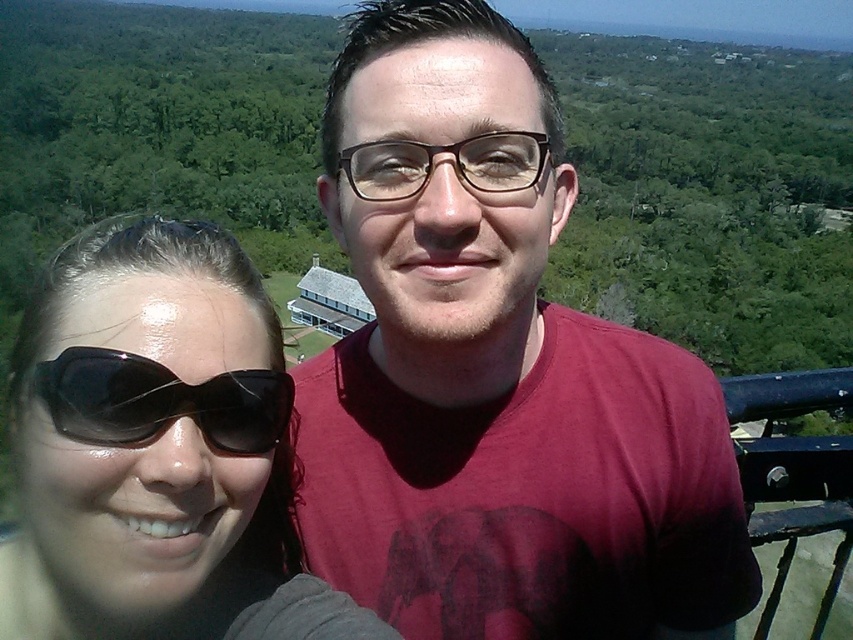
Question: Which point is farther to the camera?

Choices:
 (A) (235, 440)
 (B) (453, 560)
 (C) (138, 387)

Answer: (B)

Question: Among these objects, which one is farthest from the camera?

Choices:
 (A) sunglasses at left
 (B) matte red t-shirt at center

Answer: (B)

Question: Is the position of sunglasses at left more distant than that of black matte sunglasses at left?

Choices:
 (A) yes
 (B) no

Answer: (A)

Question: Is sunglasses at left to the right of black matte sunglasses at left from the viewer's perspective?

Choices:
 (A) yes
 (B) no

Answer: (B)

Question: Among these points, which one is nearest to the camera?

Choices:
 (A) (71, 481)
 (B) (384, 477)
 (C) (33, 378)

Answer: (C)

Question: Does sunglasses at left have a lesser width compared to black matte sunglasses at left?

Choices:
 (A) yes
 (B) no

Answer: (B)